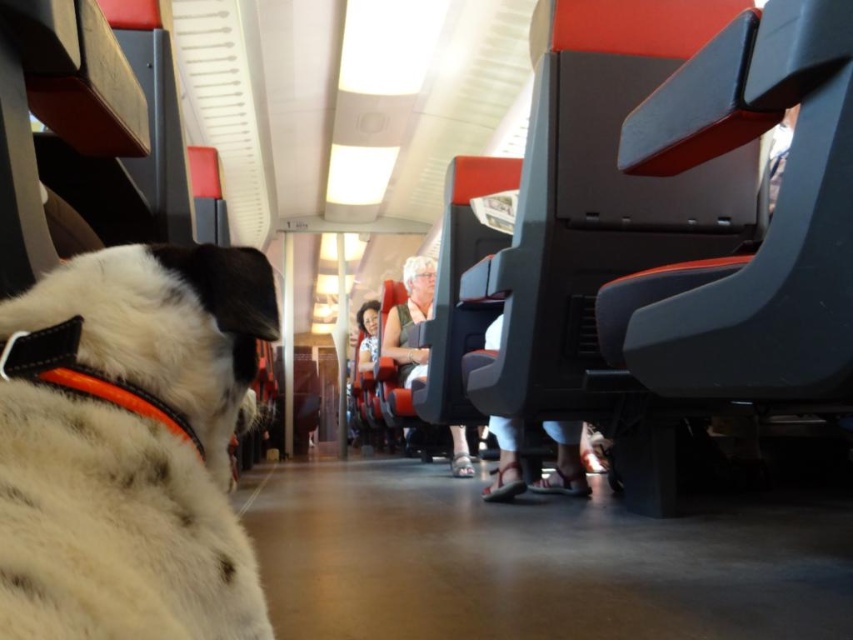
Question: Considering the real-world distances, which object is closest to the orange fabric neckband at left?

Choices:
 (A) white fur at left
 (B) matte black shirt at center
 (C) white fabric pants at center
 (D) smooth skin face at center

Answer: (A)

Question: Is white fabric pants at center to the left of matte black shirt at center from the viewer's perspective?

Choices:
 (A) yes
 (B) no

Answer: (B)

Question: In this image, where is white fur at left located relative to orange fabric neckband at left?

Choices:
 (A) below
 (B) above

Answer: (A)

Question: Estimate the real-world distances between objects in this image. Which object is closer to the white fur at left?

Choices:
 (A) matte black shirt at center
 (B) orange fabric neckband at left
 (C) smooth skin face at center
 (D) white fabric pants at center

Answer: (B)

Question: Which object is closer to the camera taking this photo?

Choices:
 (A) white fur at left
 (B) white fabric pants at center

Answer: (A)

Question: Can you confirm if white fur at left is thinner than matte black shirt at center?

Choices:
 (A) yes
 (B) no

Answer: (A)